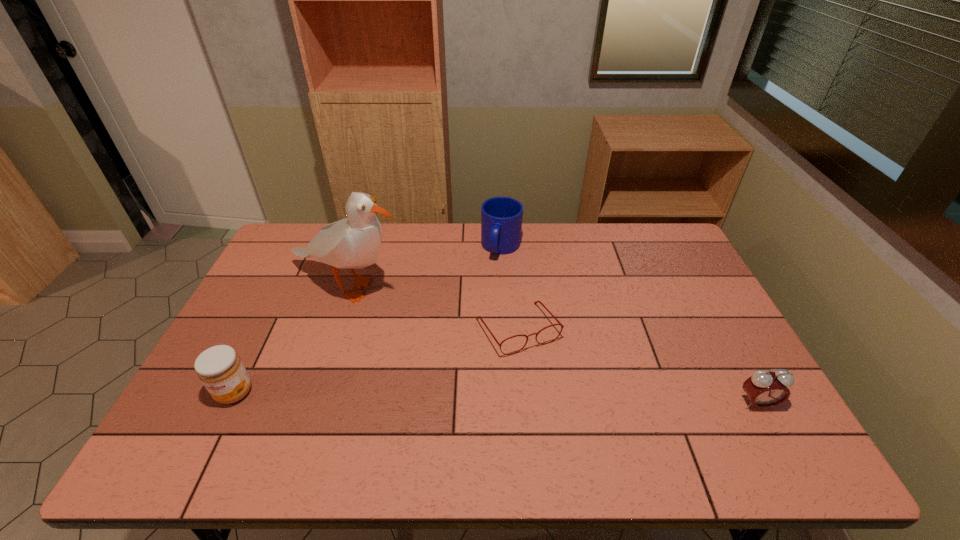
Locate an element on the screen. object that is at the right edge is located at coordinates (765, 389).

You are a GUI agent. You are given a task and a screenshot of the screen. Output one action in this format:
    pyautogui.click(x=<x>, y=<y>)
    Task: Click on the object present at the far left corner
    The width and height of the screenshot is (960, 540).
    Given the screenshot: What is the action you would take?
    pyautogui.click(x=352, y=243)

Find the location of `object that is at the near left corner`. object that is at the near left corner is located at coordinates (220, 369).

This screenshot has height=540, width=960. What are the coordinates of `object that is at the near right corner` in the screenshot? It's located at (765, 389).

Where is `vacant space at the far edge`? This screenshot has width=960, height=540. vacant space at the far edge is located at coordinates (613, 227).

In the image, there is a desktop. At what (x,y) coordinates should I click in order to perform the action: click on vacant region at the near edge. Please return your answer as a coordinate pair (x, y). Looking at the image, I should click on (266, 421).

Identify the location of free space at the left edge. pyautogui.click(x=200, y=388).

The image size is (960, 540). Identify the location of free space at the right edge. (701, 374).

What are the coordinates of `vacant space at the far left corner of the desktop` in the screenshot? It's located at point(290,252).

Locate an element on the screen. vacant space at the near right corner of the desktop is located at coordinates (728, 408).